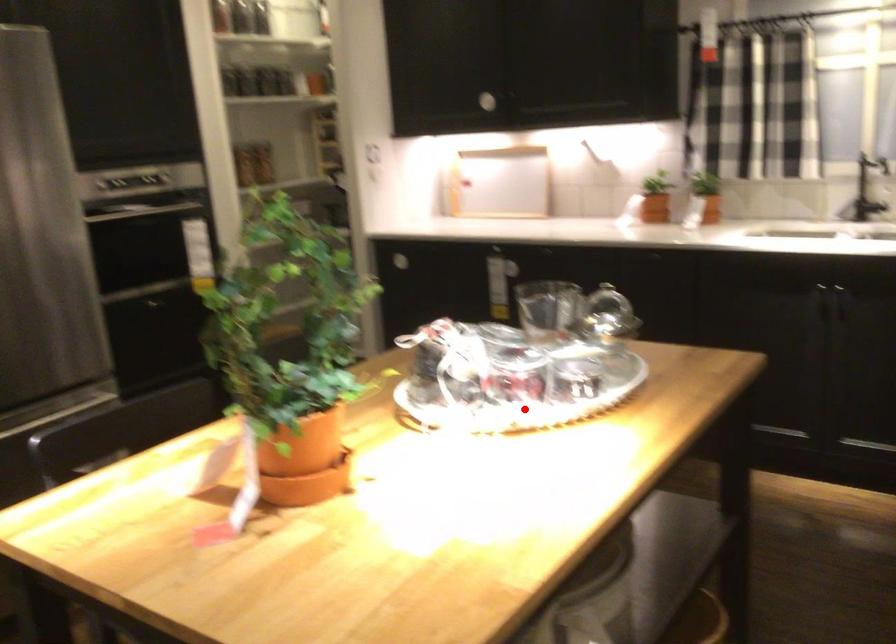
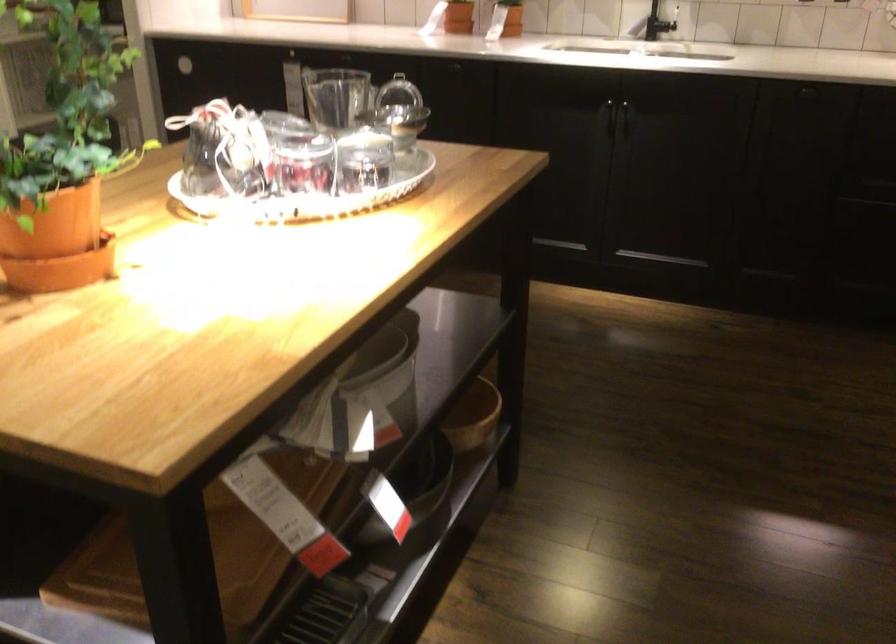
The point at the highlighted location is marked in the first image. Where is the corresponding point in the second image?

(309, 198)